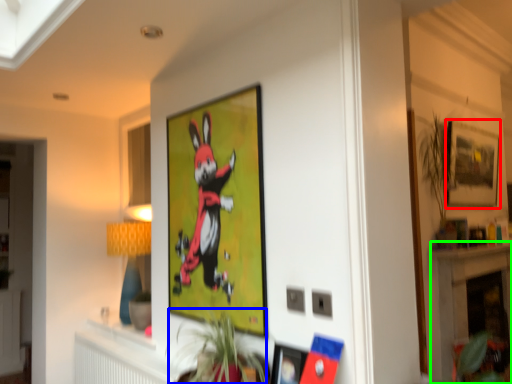
Question: Which is farther away from picture frame (highlighted by a red box)? plant (highlighted by a blue box) or fireplace (highlighted by a green box)?

Choices:
 (A) plant
 (B) fireplace

Answer: (A)